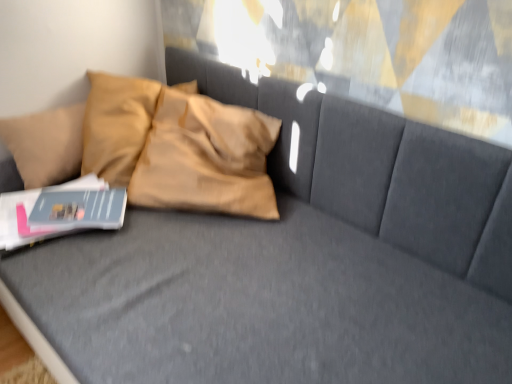
This screenshot has height=384, width=512. What do you see at coordinates (59, 211) in the screenshot? I see `matte gray book at lower left` at bounding box center [59, 211].

The image size is (512, 384). Find the location of `matte gray book at lower left`. matte gray book at lower left is located at coordinates (59, 211).

The width and height of the screenshot is (512, 384). Describe the element at coordinates (79, 209) in the screenshot. I see `matte gray magazine at lower left` at that location.

Locate an element on the screen. matte gray magazine at lower left is located at coordinates (79, 209).

Measure the distance between matte gray magazine at lower left and camera.

matte gray magazine at lower left is 1.15 meters away from camera.

Where is `matte gray book at lower left`? The height and width of the screenshot is (384, 512). matte gray book at lower left is located at coordinates (59, 211).

Is matte gray magazine at lower left to the left of matte gray book at lower left from the viewer's perspective?

No, matte gray magazine at lower left is not to the left of matte gray book at lower left.

Considering their positions, is matte gray magazine at lower left located in front of or behind matte gray book at lower left?

matte gray magazine at lower left is behind matte gray book at lower left.

Considering the points (83, 206) and (59, 233), which point is behind, point (83, 206) or point (59, 233)?

The point (83, 206) is behind.

From the image's perspective, which object appears higher, matte gray magazine at lower left or matte gray book at lower left?

matte gray magazine at lower left appears higher in the image.

From a real-world perspective, who is located lower, matte gray magazine at lower left or matte gray book at lower left?

In real-world perspective, matte gray book at lower left is lower.

Is matte gray magazine at lower left thinner than matte gray book at lower left?

Correct, the width of matte gray magazine at lower left is less than that of matte gray book at lower left.

From their relative heights in the image, would you say matte gray magazine at lower left is taller or shorter than matte gray book at lower left?

Considering their sizes, matte gray magazine at lower left has less height than matte gray book at lower left.

Considering the sizes of objects matte gray magazine at lower left and matte gray book at lower left in the image provided, who is bigger, matte gray magazine at lower left or matte gray book at lower left?

matte gray book at lower left.

Is matte gray book at lower left surrounded by matte gray magazine at lower left?

No, matte gray magazine at lower left does not contain matte gray book at lower left.

Is matte gray magazine at lower left touching matte gray book at lower left?

Yes, matte gray magazine at lower left is in contact with matte gray book at lower left.

Could you tell me if matte gray magazine at lower left is turned towards matte gray book at lower left?

No, matte gray magazine at lower left is not facing towards matte gray book at lower left.

What's the angular difference between matte gray magazine at lower left and matte gray book at lower left's facing directions?

matte gray magazine at lower left and matte gray book at lower left are facing 22.9 degrees away from each other.

I want to click on magazine lying above the matte gray book at lower left (from the image's perspective), so click(x=79, y=209).

Which is more to the right, matte gray book at lower left or matte gray magazine at lower left?

matte gray magazine at lower left is more to the right.

Relative to matte gray magazine at lower left, is matte gray book at lower left in front or behind?

matte gray book at lower left is positioned closer to the viewer than matte gray magazine at lower left.

Is point (93, 218) closer to viewer compared to point (92, 195)?

Yes, point (93, 218) is in front of point (92, 195).

From the image's perspective, does matte gray book at lower left appear higher than matte gray magazine at lower left?

Actually, matte gray book at lower left appears below matte gray magazine at lower left in the image.

Based on the photo, from a real-world perspective, which is physically below, matte gray book at lower left or matte gray magazine at lower left?

matte gray book at lower left is physically lower.

Which object is thinner, matte gray book at lower left or matte gray magazine at lower left?

matte gray magazine at lower left.

Who is taller, matte gray book at lower left or matte gray magazine at lower left?

matte gray book at lower left is taller.

Between matte gray book at lower left and matte gray magazine at lower left, which one has larger size?

matte gray book at lower left.

Is matte gray book at lower left surrounding matte gray magazine at lower left?

Yes, matte gray magazine at lower left is a part of matte gray book at lower left.

Is matte gray book at lower left next to matte gray magazine at lower left?

Indeed, matte gray book at lower left and matte gray magazine at lower left are beside each other and touching.

Is matte gray book at lower left aimed at matte gray magazine at lower left?

No, matte gray book at lower left is not aimed at matte gray magazine at lower left.

Where is `paperback book that is under the matte gray magazine at lower left (from a real-world perspective)`? Image resolution: width=512 pixels, height=384 pixels. paperback book that is under the matte gray magazine at lower left (from a real-world perspective) is located at coordinates (59, 211).

Find the location of a particular element. magazine located above the matte gray book at lower left (from the image's perspective) is located at coordinates (79, 209).

Identify the location of magazine behind the matte gray book at lower left. This screenshot has height=384, width=512. (79, 209).